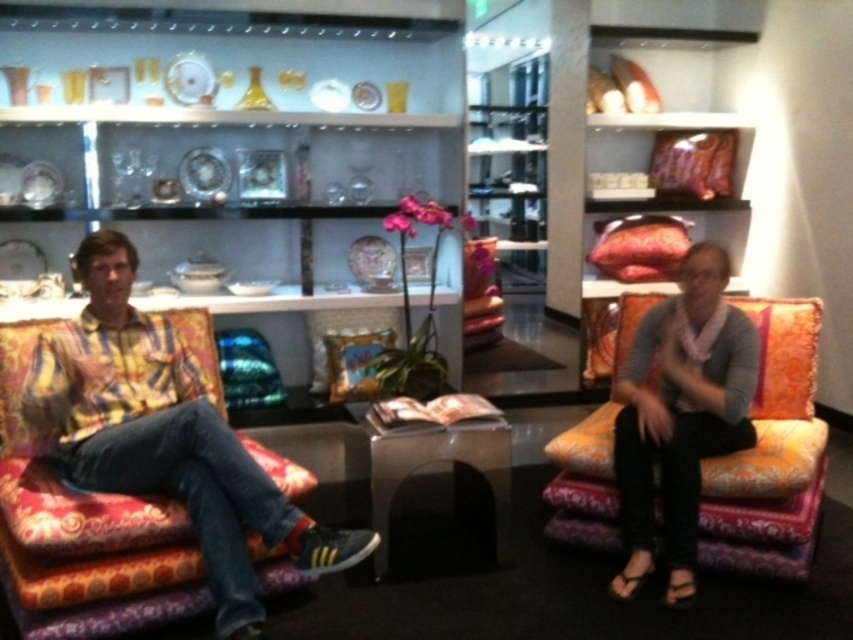
Is printed fabric shirt at left bigger than black glossy side table at center?

Yes, printed fabric shirt at left is bigger than black glossy side table at center.

Between point (204, 547) and point (426, 452), which one is positioned behind?

Point (426, 452)

Locate an element on the screen. printed fabric shirt at left is located at coordinates (166, 436).

Does orange patterned fabric couch at center have a greater height compared to matte yellow shirt at center?

No.

Is orange patterned fabric couch at center smaller than matte yellow shirt at center?

Actually, orange patterned fabric couch at center might be larger than matte yellow shirt at center.

Identify the location of orange patterned fabric couch at center. The width and height of the screenshot is (853, 640). (770, 456).

Which is more to the right, printed fabric shirt at left or matte yellow shirt at center?

Positioned to the right is matte yellow shirt at center.

Between point (41, 433) and point (641, 541), which one is positioned in front?

Point (41, 433) is in front.

Image resolution: width=853 pixels, height=640 pixels. What are the coordinates of `printed fabric shirt at left` in the screenshot? It's located at coord(166,436).